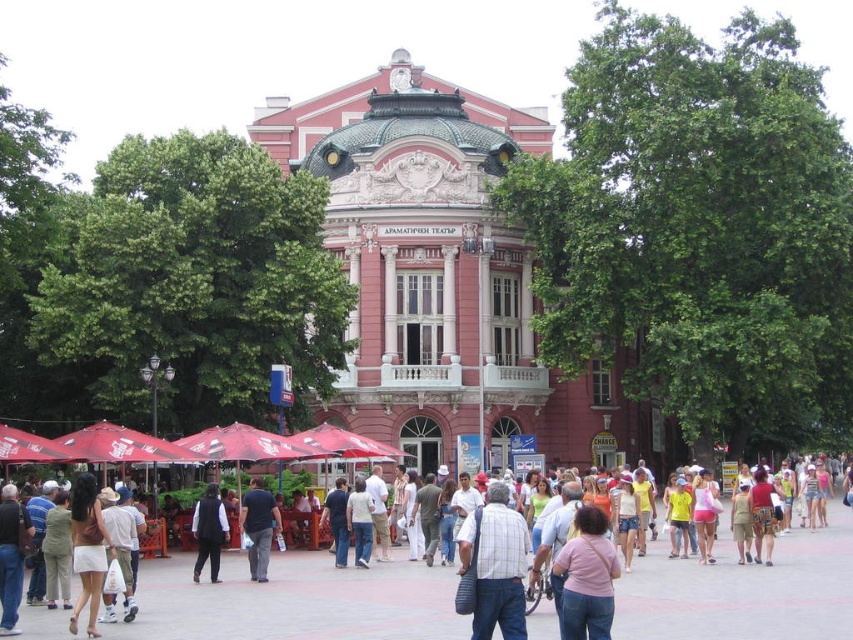
Is pink fabric shirt at center in front of matte white skirt at lower left?

Yes, it is.

Can you confirm if pink fabric shirt at center is shorter than matte white skirt at lower left?

Correct, pink fabric shirt at center is not as tall as matte white skirt at lower left.

Does point (582, 573) come in front of point (102, 524)?

That is True.

Locate an element on the screen. This screenshot has width=853, height=640. pink fabric shirt at center is located at coordinates (587, 577).

Who is shorter, pink fabric dress at center or plaid shirt at center?

pink fabric dress at center

The height and width of the screenshot is (640, 853). Describe the element at coordinates (294, 602) in the screenshot. I see `pink fabric dress at center` at that location.

Does point (757, 621) come behind point (521, 586)?

Yes, point (757, 621) is behind point (521, 586).

Where is `pink fabric dress at center`? The height and width of the screenshot is (640, 853). pink fabric dress at center is located at coordinates (294, 602).

Who is shorter, pink fabric dress at center or black leather vest at center?

Standing shorter between the two is pink fabric dress at center.

Does pink fabric dress at center have a greater height compared to black leather vest at center?

No, pink fabric dress at center is not taller than black leather vest at center.

Is point (804, 598) positioned in front of point (213, 580)?

Yes, point (804, 598) is closer to viewer.

Locate an element on the screen. pink fabric dress at center is located at coordinates (294, 602).